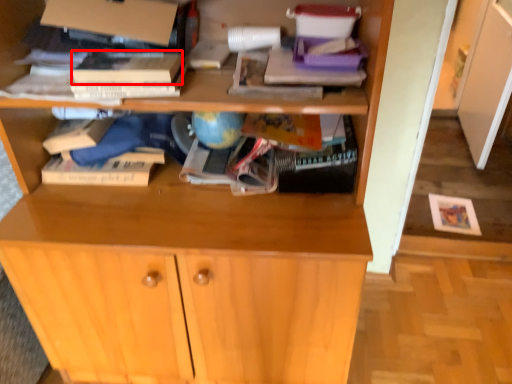
Question: From the image's perspective, what is the correct spatial relationship of paperback book (annotated by the red box) in relation to cabinetry?

Choices:
 (A) below
 (B) above

Answer: (B)